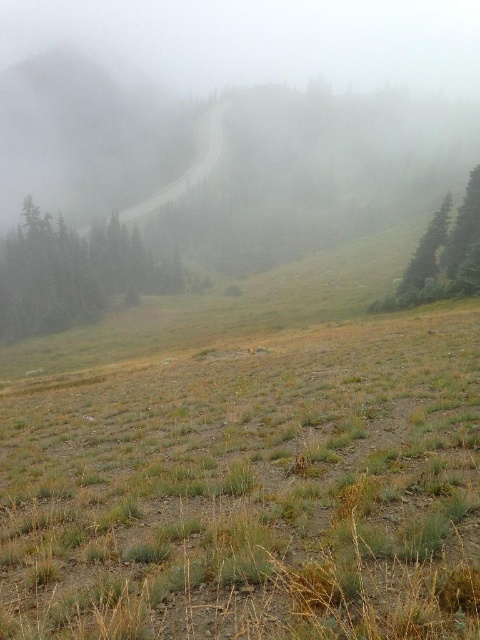
I want to click on green matte tree at left, so click(73, 273).

Who is more forward, (x=92, y=236) or (x=424, y=264)?

Point (x=424, y=264)

What are the coordinates of `green matte tree at left` in the screenshot? It's located at (73, 273).

Does point (159, 554) come in front of point (435, 257)?

Yes, point (159, 554) is closer to viewer.

Which is behind, point (56, 394) or point (469, 248)?

Positioned behind is point (469, 248).

Locate an element on the screen. dry grass at lower center is located at coordinates (251, 490).

Is dry grass at lower center smaller than green matte tree at left?

Yes.

You are a GUI agent. You are given a task and a screenshot of the screen. Output one action in this format:
    pyautogui.click(x=<x>, y=<y>)
    Task: Click on the dry grass at lower center
    
    Given the screenshot: What is the action you would take?
    pyautogui.click(x=251, y=490)

Which is in front, point (376, 492) or point (118, 243)?

Point (376, 492) is more forward.

This screenshot has width=480, height=640. I want to click on dry grass at lower center, so click(251, 490).